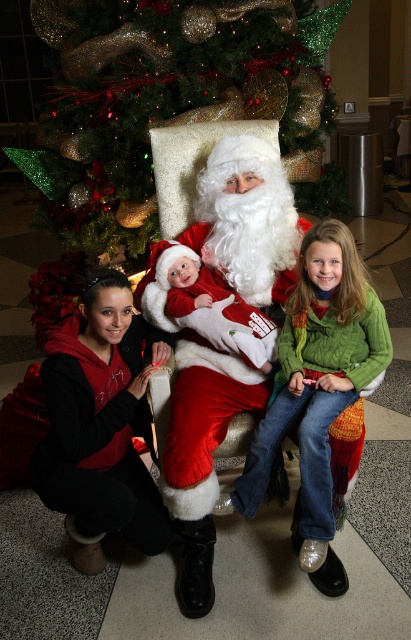
You are organizing a holiday photo shoot and need to ensure that the green glittery christmas tree at upper center and the green knitted sweater at center are visible in the frame. Since the tree is wider, how should you adjust the camera angle to include both objects without cropping either?

The green glittery christmas tree at upper center is wider than the green knitted sweater at center, so you should position the camera to focus on the center area while widening the lens or stepping back slightly to capture the full width of the tree while still including the sweater in the frame.

Looking at this image, you are standing in the holiday scene and want to place a gift box at point (115, 17). If your arm reaches 2.5 meters, can you reach that point?

The distance of point (115, 17) from viewer is 2.77 meters, so no, you cannot reach that point with an arm length of 2.5 meters.

You are a photographer planning to take a photo of Santa Claus and the children. The green glittery christmas tree at upper center is part of the background. To ensure the tree is centered in the photo, where should you position the camera relative to the scene?

The green glittery christmas tree at upper center is located at point 0.155 on the x axis and 0.406 on the y axis. To center the tree in the photo, position the camera so that the tree is aligned with the center point of the frame, which would require adjusting the camera to the left and slightly downward from the tree.